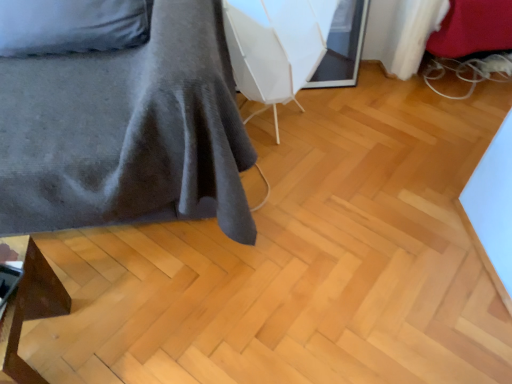
Where is `free space in front of white plastic swivel chair at center`? This screenshot has height=384, width=512. free space in front of white plastic swivel chair at center is located at coordinates (295, 188).